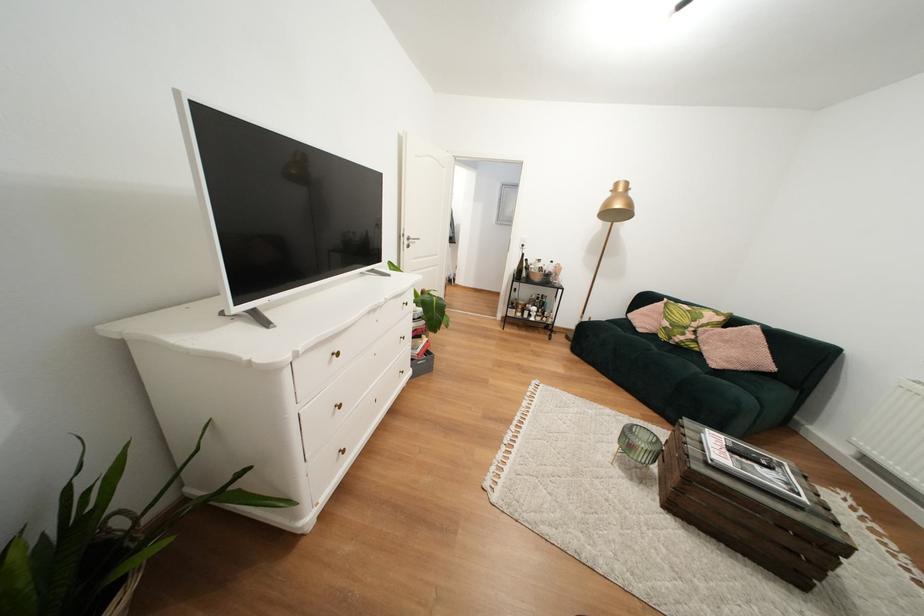
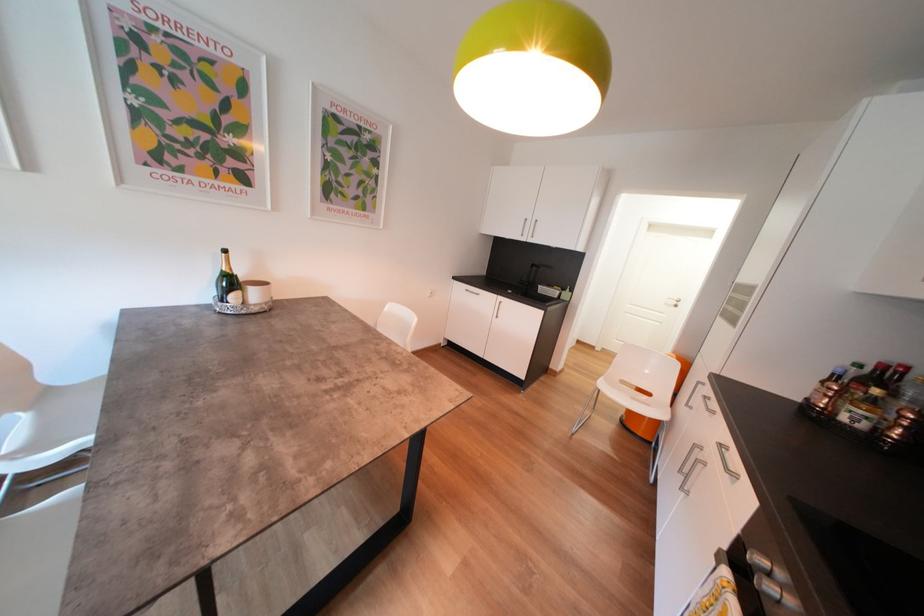
The images are taken continuously from a first-person perspective. In which direction are you moving?

The movement direction of the cameraman is left, forward.